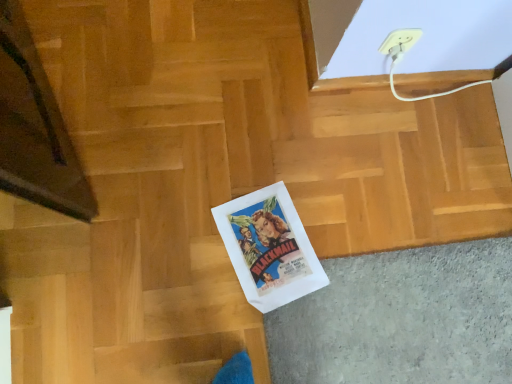
The image size is (512, 384). What do you see at coordinates (144, 192) in the screenshot?
I see `white paper bag at center` at bounding box center [144, 192].

Looking at this image, what is the approximate width of white paper bag at center?

white paper bag at center is 1.19 meters in width.

Where is `white paper bag at center`? The height and width of the screenshot is (384, 512). white paper bag at center is located at coordinates (144, 192).

Image resolution: width=512 pixels, height=384 pixels. What do you see at coordinates (400, 39) in the screenshot?
I see `white plastic electric outlet at upper right` at bounding box center [400, 39].

Where is `white plastic electric outlet at upper right`? white plastic electric outlet at upper right is located at coordinates (400, 39).

I want to click on white paper bag at center, so click(x=144, y=192).

Is white plastic electric outlet at upper right at the left side of white paper bag at center?

No.

Which object is further away from the camera, white plastic electric outlet at upper right or white paper bag at center?

Positioned behind is white plastic electric outlet at upper right.

Does point (403, 42) come in front of point (197, 167)?

Yes, point (403, 42) is in front of point (197, 167).

From the image's perspective, between white plastic electric outlet at upper right and white paper bag at center, who is located below?

white paper bag at center is shown below in the image.

From a real-world perspective, is white plastic electric outlet at upper right positioned above or below white paper bag at center?

In terms of real-world spatial position, white plastic electric outlet at upper right is above white paper bag at center.

Which of these two, white plastic electric outlet at upper right or white paper bag at center, is wider?

white paper bag at center is wider.

From the picture: Considering the sizes of objects white plastic electric outlet at upper right and white paper bag at center in the image provided, who is taller, white plastic electric outlet at upper right or white paper bag at center?

white plastic electric outlet at upper right is taller.

Which of these two, white plastic electric outlet at upper right or white paper bag at center, is bigger?

white paper bag at center is bigger.

Is white plastic electric outlet at upper right inside the boundaries of white paper bag at center, or outside?

white plastic electric outlet at upper right lies outside white paper bag at center.

Would you consider white plastic electric outlet at upper right to be distant from white paper bag at center?

white plastic electric outlet at upper right is near white paper bag at center, not far away.

Could you tell me if white plastic electric outlet at upper right is facing white paper bag at center?

No, white plastic electric outlet at upper right does not turn towards white paper bag at center.

How many degrees apart are the facing directions of white plastic electric outlet at upper right and white paper bag at center?

The angle between the facing direction of white plastic electric outlet at upper right and the facing direction of white paper bag at center is 0.931 degrees.

Measure the distance between white plastic electric outlet at upper right and white paper bag at center.

27.26 inches.

What are the coordinates of `stairwell on the left of white plastic electric outlet at upper right` in the screenshot? It's located at (144, 192).

Based on the photo, is white paper bag at center at the right side of white plastic electric outlet at upper right?

Incorrect, white paper bag at center is not on the right side of white plastic electric outlet at upper right.

In the image, is white paper bag at center positioned in front of or behind white plastic electric outlet at upper right?

Visually, white paper bag at center is located in front of white plastic electric outlet at upper right.

Is point (211, 351) closer or farther from the camera than point (418, 39)?

Clearly, point (211, 351) is more distant from the camera than point (418, 39).

From the image's perspective, relative to white plastic electric outlet at upper right, is white paper bag at center above or below?

white paper bag at center is situated lower than white plastic electric outlet at upper right in the image.

From a real-world perspective, is white paper bag at center on white plastic electric outlet at upper right?

No, from a real-world perspective, white paper bag at center is not on top of white plastic electric outlet at upper right.

Which of these two, white paper bag at center or white plastic electric outlet at upper right, is thinner?

Thinner between the two is white plastic electric outlet at upper right.

Considering the sizes of white paper bag at center and white plastic electric outlet at upper right in the image, is white paper bag at center taller or shorter than white plastic electric outlet at upper right?

In the image, white paper bag at center appears to be shorter than white plastic electric outlet at upper right.

Considering the sizes of objects white paper bag at center and white plastic electric outlet at upper right in the image provided, who is bigger, white paper bag at center or white plastic electric outlet at upper right?

Bigger between the two is white paper bag at center.

Is white paper bag at center not within white plastic electric outlet at upper right?

Indeed, white paper bag at center is completely outside white plastic electric outlet at upper right.

Are white paper bag at center and white plastic electric outlet at upper right making contact?

white paper bag at center is not next to white plastic electric outlet at upper right, and they're not touching.

Is white paper bag at center facing away from white plastic electric outlet at upper right?

No, white paper bag at center's orientation is not away from white plastic electric outlet at upper right.

What's the angular difference between white paper bag at center and white plastic electric outlet at upper right's facing directions?

There is a 0.931-degree angle between the facing directions of white paper bag at center and white plastic electric outlet at upper right.

Based on the photo, measure the distance from white paper bag at center to white plastic electric outlet at upper right.

white paper bag at center is 27.26 inches away from white plastic electric outlet at upper right.

The width and height of the screenshot is (512, 384). In the image, there is a white paper bag at center. Identify the location of electric outlet above it (from the image's perspective). (400, 39).

In the image, there is a white plastic electric outlet at upper right. Where is `stairwell below it (from a real-world perspective)`? Image resolution: width=512 pixels, height=384 pixels. stairwell below it (from a real-world perspective) is located at coordinates (144, 192).

I want to click on electric outlet to the right of white paper bag at center, so click(x=400, y=39).